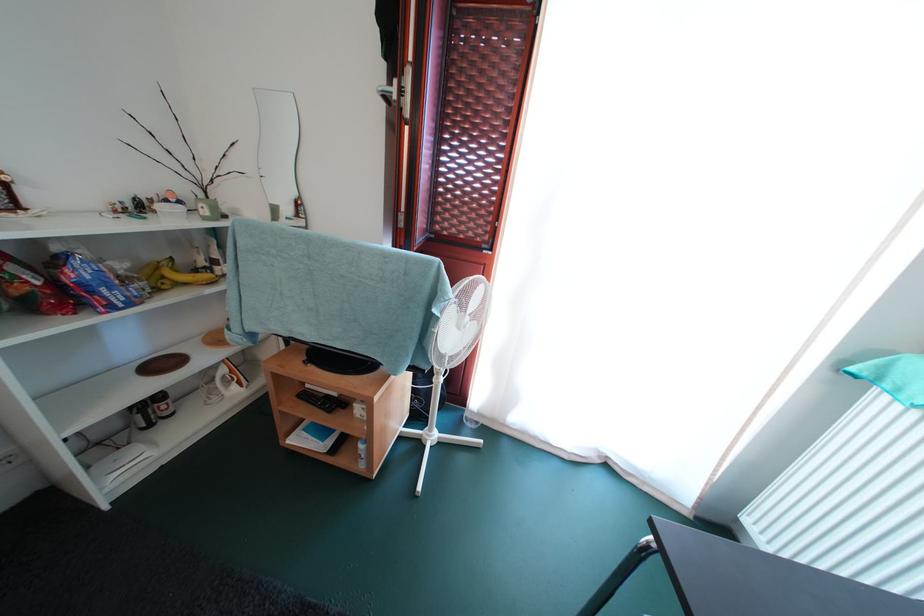
Image resolution: width=924 pixels, height=616 pixels. What do you see at coordinates (618, 575) in the screenshot? I see `the iron handle` at bounding box center [618, 575].